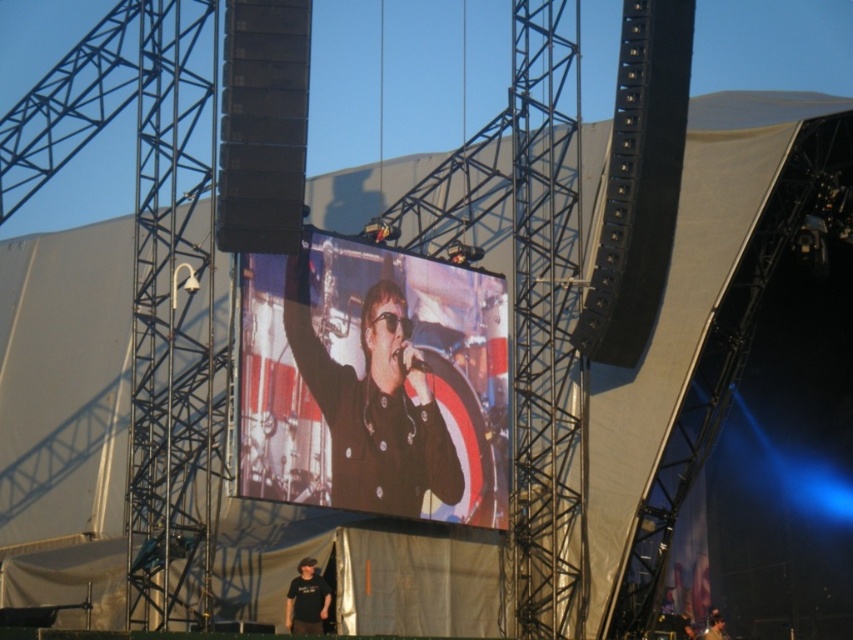
You are a stagehand setting up a spotlight for the performer. You need to position the light so it illuminates the black matte jacket at center without shining on the black matte shirt at lower center. Based on their positions, which direction should you aim the spotlight?

The black matte jacket at center is to the right of the black matte shirt at lower center, so you should aim the spotlight towards the right side to illuminate the jacket while avoiding the shirt.

Consider the image. You are a photographer at the concert venue. You want to take a photo of the black matte jacket at center. Where should you position your camera to capture it?

The black matte jacket at center is located at point 0.630 on the x axis and 0.438 on the y axis. Position the camera directly facing that coordinate for the best capture.